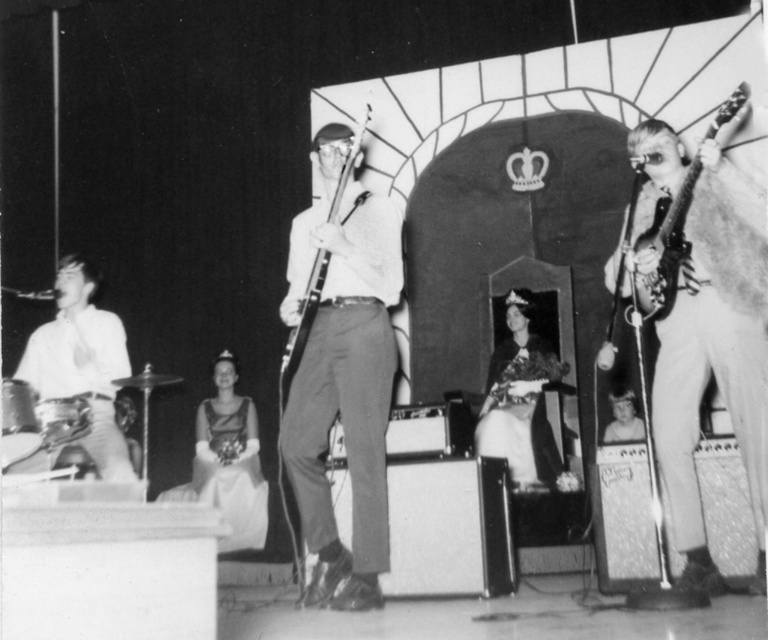
In the scene shown: Measure the distance from matte gray pants at center to smooth white shirt at left.

1.08 meters

Does matte gray pants at center have a larger size compared to smooth white shirt at left?

Actually, matte gray pants at center might be smaller than smooth white shirt at left.

Does point (373, 442) lie in front of point (68, 272)?

That is True.

This screenshot has height=640, width=768. Find the location of `matte gray pants at center`. matte gray pants at center is located at coordinates (343, 376).

Is point (763, 406) positioned before point (381, 371)?

Yes, it is in front of point (381, 371).

Looking at this image, which is more to the right, shiny silver guitar at right or matte gray pants at center?

Positioned to the right is shiny silver guitar at right.

Measure the distance between shiny silver guitar at right and camera.

They are 3.41 meters apart.

Locate an element on the screen. shiny silver guitar at right is located at coordinates (692, 342).

Does shiny silver guitar at right lie in front of smooth white shirt at left?

Yes, shiny silver guitar at right is in front of smooth white shirt at left.

Which is more to the left, shiny silver guitar at right or smooth white shirt at left?

Positioned to the left is smooth white shirt at left.

Locate an element on the screen. The width and height of the screenshot is (768, 640). shiny silver guitar at right is located at coordinates (692, 342).